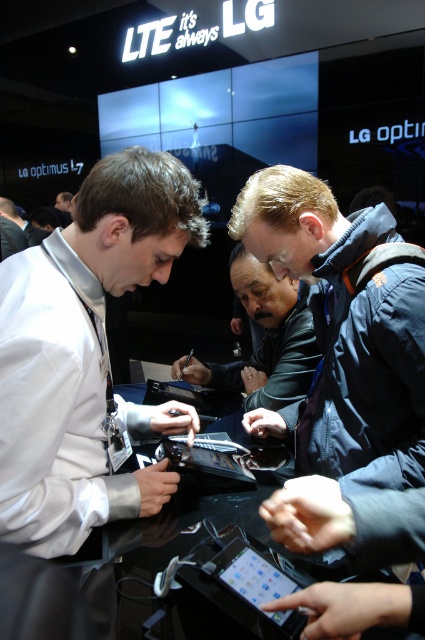
Is black leather jacket at center thinner than metallic silver tablet at center?

No, black leather jacket at center is not thinner than metallic silver tablet at center.

Is black leather jacket at center positioned behind metallic silver tablet at center?

That is True.

Is point (189, 378) less distant than point (193, 444)?

That is False.

The height and width of the screenshot is (640, 425). Find the location of `black leather jacket at center`. black leather jacket at center is located at coordinates (265, 339).

Is blue fabric jacket at center shorter than black leather jacket at center?

No.

Does blue fabric jacket at center have a smaller size compared to black leather jacket at center?

Correct, blue fabric jacket at center occupies less space than black leather jacket at center.

In order to click on blue fabric jacket at center in this screenshot , I will do `click(346, 330)`.

The image size is (425, 640). Find the location of `blue fabric jacket at center`. blue fabric jacket at center is located at coordinates (346, 330).

Can you confirm if white glossy shirt at left is positioned below metallic silver tablet at center?

Incorrect, white glossy shirt at left is not positioned below metallic silver tablet at center.

Between white glossy shirt at left and metallic silver tablet at center, which one has more height?

With more height is white glossy shirt at left.

Identify the location of white glossy shirt at left. The height and width of the screenshot is (640, 425). (82, 349).